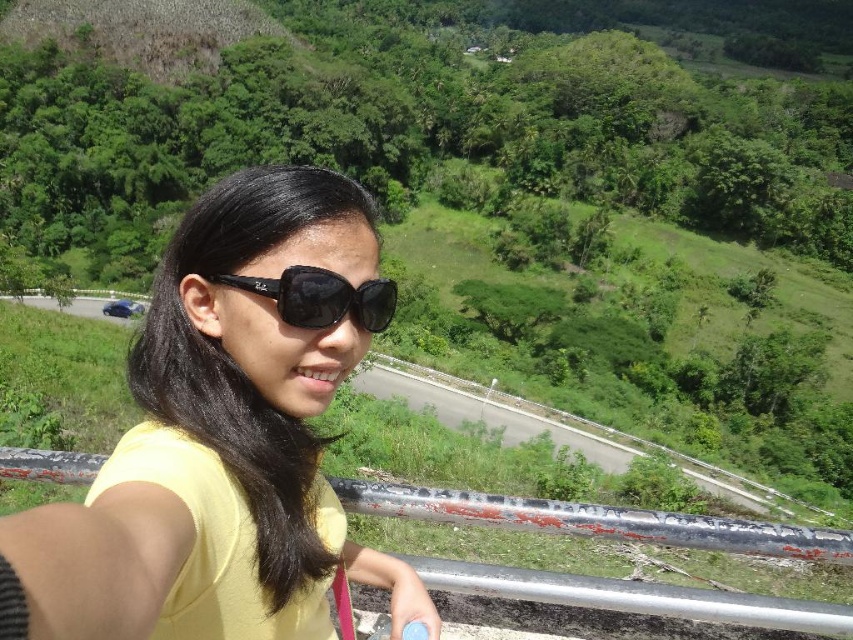
You are a photographer trying to capture the perfect shot of the person leaning against the rusty metal rail at center and wearing the black reflective sunglasses at center. If you want to ensure both objects are clearly visible in the frame, which object should you focus on first considering their sizes?

The rusty metal rail at center has a larger width than the black reflective sunglasses at center, so you should focus on the rusty metal rail at center first to ensure both are clearly visible.